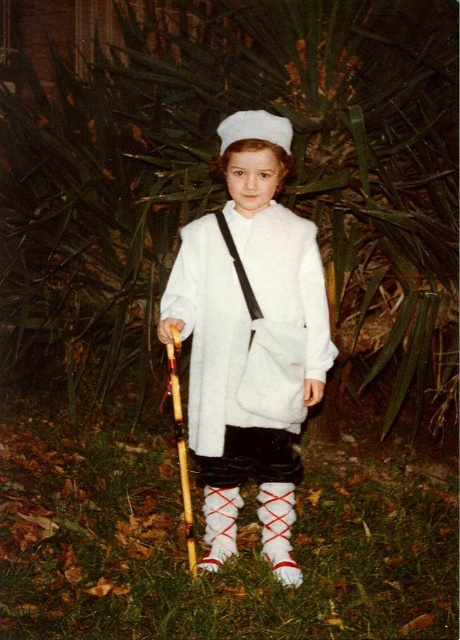
Does white fuzzy coat at center have a greater height compared to white felt hat at center?

Yes, white fuzzy coat at center is taller than white felt hat at center.

Who is higher up, white fuzzy coat at center or white felt hat at center?

Positioned higher is white felt hat at center.

Does point (298, 358) lie in front of point (253, 131)?

No, it is behind (253, 131).

I want to click on white fuzzy coat at center, so click(249, 349).

Is green grass at lower center further to camera compared to white felt hat at center?

No, it is not.

Between point (111, 616) and point (275, 140), which one is positioned in front?

Point (275, 140) is in front.

What are the coordinates of `green grass at lower center` in the screenshot? It's located at (226, 564).

Between green grass at lower center and white fuzzy coat at center, which one appears on the left side from the viewer's perspective?

Positioned to the left is green grass at lower center.

Does green grass at lower center have a greater height compared to white fuzzy coat at center?

No, green grass at lower center is not taller than white fuzzy coat at center.

Does point (379, 548) lie in front of point (216, 420)?

No, it is behind (216, 420).

The height and width of the screenshot is (640, 460). I want to click on green grass at lower center, so click(x=226, y=564).